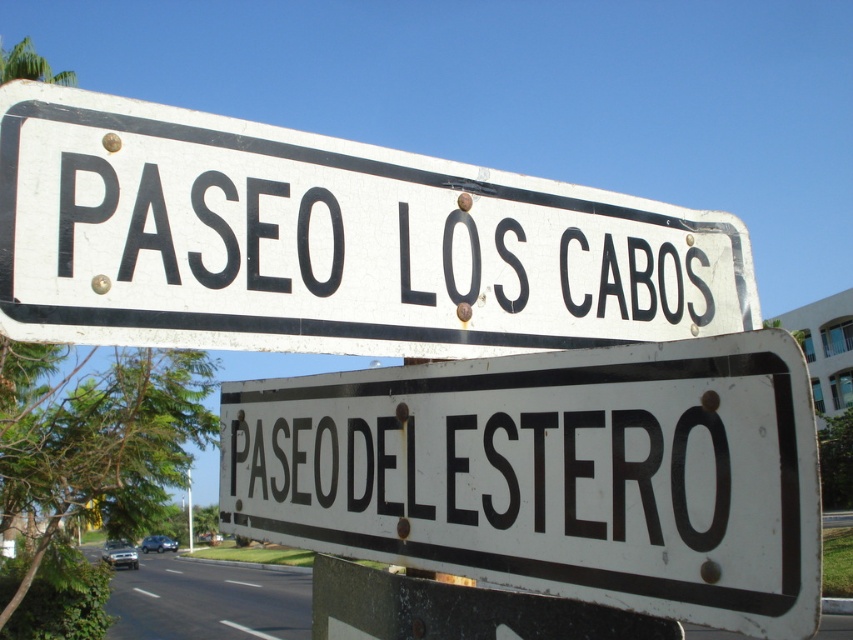
You are standing in front of the two street signs on the pole. There are two points marked on the signs. Which point, point (422, 531) or point (416, 538), is closer to you?

Point (422, 531) is closer to the viewer than point (416, 538).